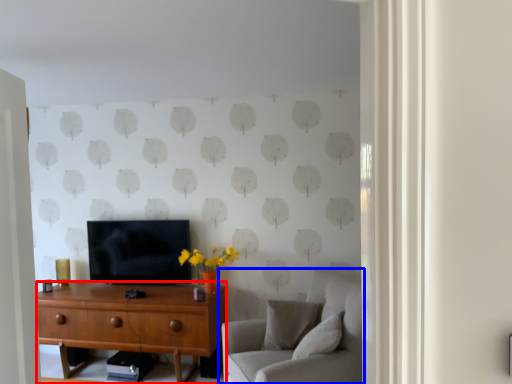
Question: Which of the following is the closest to the observer, desk (highlighted by a red box) or studio couch (highlighted by a blue box)?

Choices:
 (A) desk
 (B) studio couch

Answer: (B)